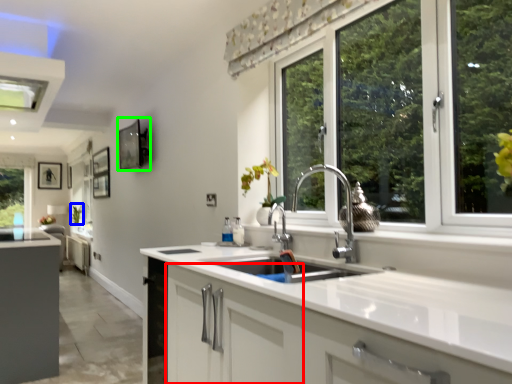
Question: Based on their relative distances, which object is nearer to cabinetry (highlighted by a red box)? Choose from plant (highlighted by a blue box) and picture frame (highlighted by a green box).

Choices:
 (A) plant
 (B) picture frame

Answer: (B)